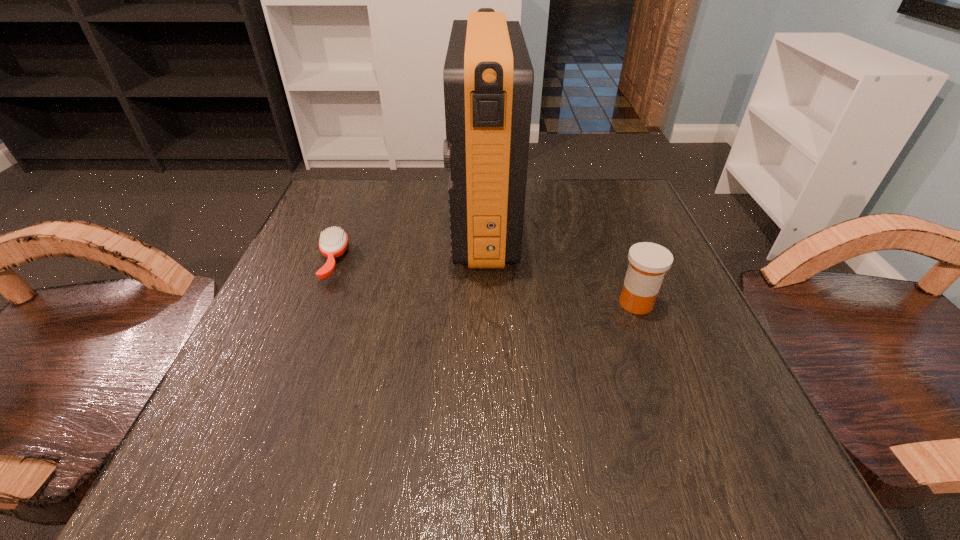
The width and height of the screenshot is (960, 540). Find the location of `free region located on the label of the rightmost object`. free region located on the label of the rightmost object is located at coordinates click(x=501, y=303).

Identify the location of vacant space located 0.230m on the label of the rightmost object. This screenshot has height=540, width=960. (484, 303).

Where is `blank area located on the right of the hairbrush`? Image resolution: width=960 pixels, height=540 pixels. blank area located on the right of the hairbrush is located at coordinates point(419,260).

You are a GUI agent. You are given a task and a screenshot of the screen. Output one action in this format:
    pyautogui.click(x=<x>, y=<y>)
    Task: Click on the object at the far edge
    
    Given the screenshot: What is the action you would take?
    pyautogui.click(x=488, y=77)

Identify the location of object located in the left edge section of the desktop. The height and width of the screenshot is (540, 960). (333, 243).

What are the coordinates of `object that is positioned at the right edge` in the screenshot? It's located at (648, 262).

In the image, there is a desktop. Where is `vacant space at the far edge`? This screenshot has height=540, width=960. vacant space at the far edge is located at coordinates (410, 218).

Identify the location of free space at the left edge of the desktop. Image resolution: width=960 pixels, height=540 pixels. (234, 407).

At what (x,y) coordinates should I click in order to perform the action: click on vacant space at the right edge. Please return your answer as a coordinate pair (x, y). Looking at the image, I should click on (651, 346).

Locate an element on the screen. free space at the far left corner of the desktop is located at coordinates (308, 218).